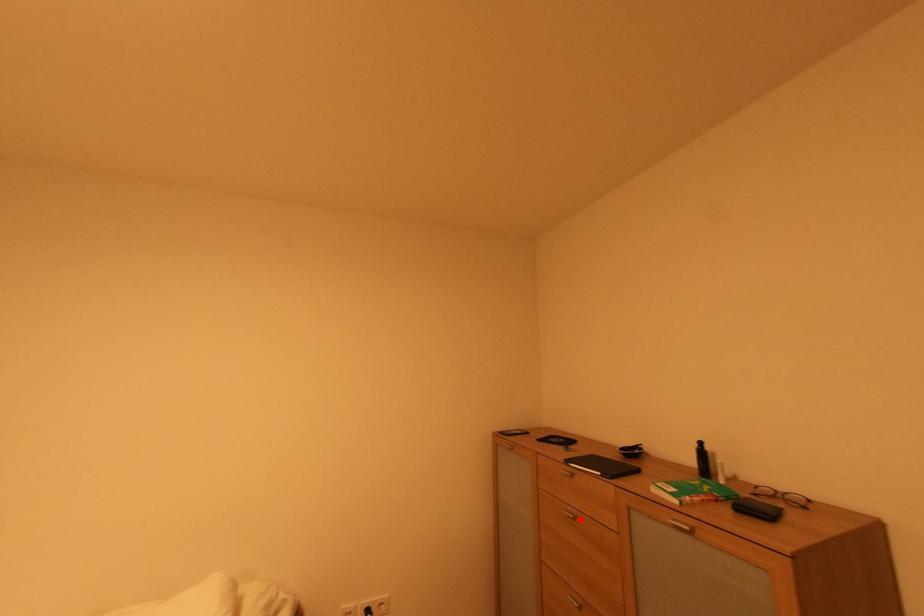
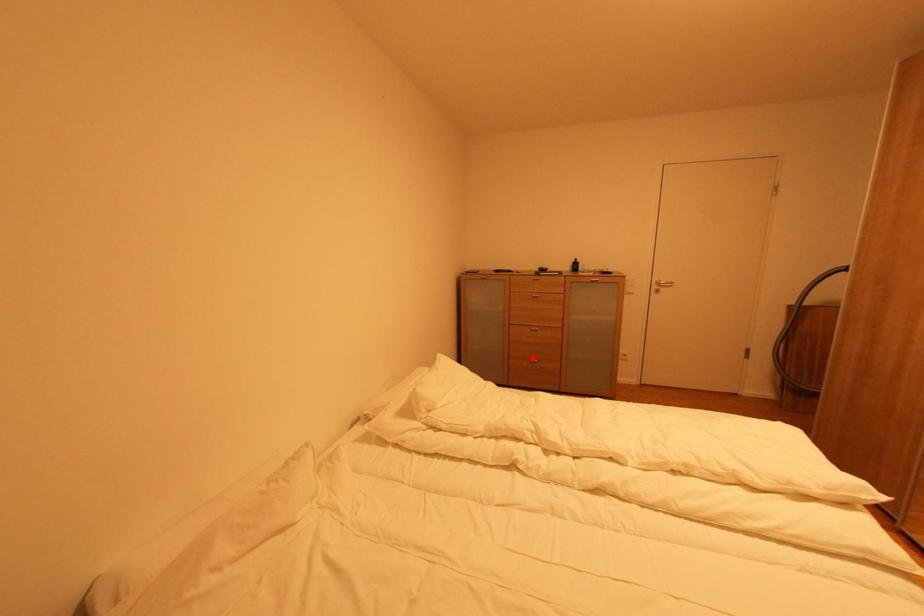
I am providing you with two images of the same scene from different viewpoints. A red point is marked on the first image and another point is marked on the second image. Are the points marked in image1 and image2 representing the same 3D position?

No